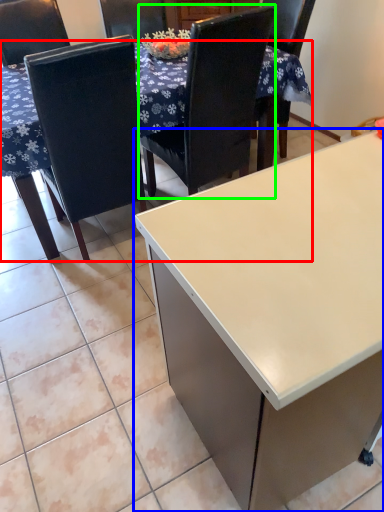
Question: Which object is the closest to the table (highlighted by a red box)? Choose among these: desk (highlighted by a blue box) or chair (highlighted by a green box).

Choices:
 (A) desk
 (B) chair

Answer: (B)